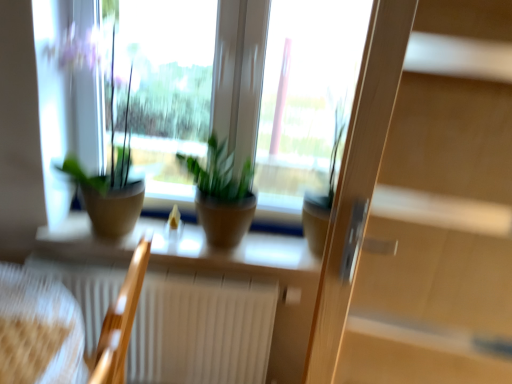
Locate an element on the screen. This screenshot has width=512, height=384. empty space that is ontop of white textured radiator at lower center (from a real-world perspective) is located at coordinates (183, 271).